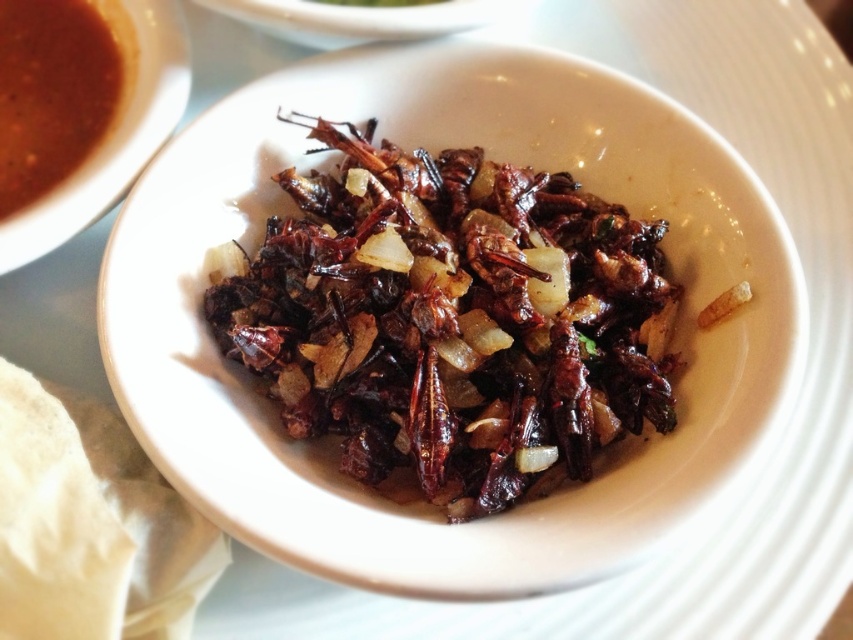
Question: Which of the following is the farthest from the observer?

Choices:
 (A) (631, 316)
 (B) (38, 28)

Answer: (B)

Question: Does brown crispy insects at center have a larger size compared to brown matte soup at upper left?

Choices:
 (A) yes
 (B) no

Answer: (A)

Question: Is brown crispy insects at center closer to the viewer compared to brown matte soup at upper left?

Choices:
 (A) no
 (B) yes

Answer: (B)

Question: Which point is closer to the camera?

Choices:
 (A) brown crispy insects at center
 (B) brown matte soup at upper left

Answer: (A)

Question: Is brown crispy insects at center thinner than brown matte soup at upper left?

Choices:
 (A) yes
 (B) no

Answer: (B)